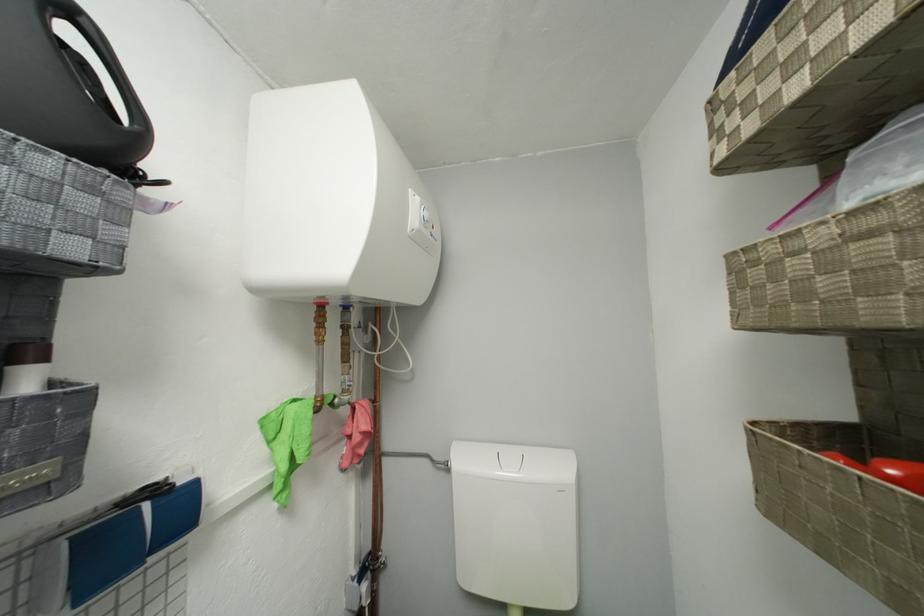
Where is `black kettle handle`? black kettle handle is located at coordinates (101, 58).